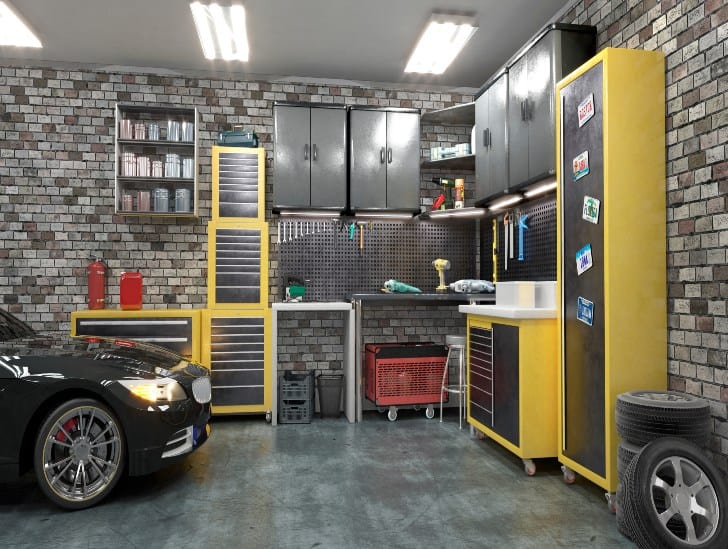
This screenshot has width=728, height=549. What are the coordinates of `black shelf` in the screenshot? It's located at (387, 300).